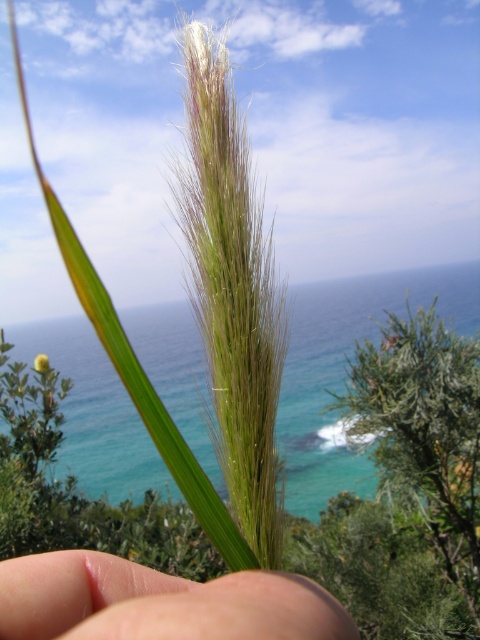
Question: Among these objects, which one is nearest to the camera?

Choices:
 (A) flesh/soft skin at center
 (B) green fuzzy flower at center

Answer: (A)

Question: Which object appears farthest from the camera in this image?

Choices:
 (A) green fuzzy flower at center
 (B) flesh/soft skin at center

Answer: (A)

Question: Observing the image, what is the correct spatial positioning of flesh/soft skin at center in reference to green fuzzy flower at center?

Choices:
 (A) below
 (B) above

Answer: (B)

Question: Is teal water at center below flesh/soft skin at center?

Choices:
 (A) no
 (B) yes

Answer: (B)

Question: Which object is closer to the camera taking this photo?

Choices:
 (A) teal water at center
 (B) green fuzzy flower at center
 (C) flesh/soft skin at center

Answer: (C)

Question: Does flesh/soft skin at center appear on the right side of green fuzzy flower at center?

Choices:
 (A) yes
 (B) no

Answer: (A)